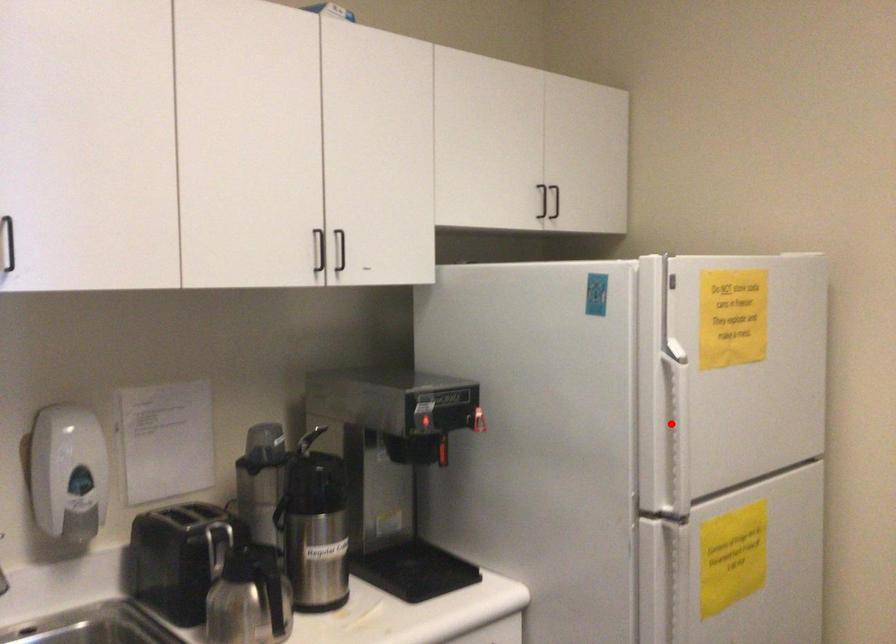
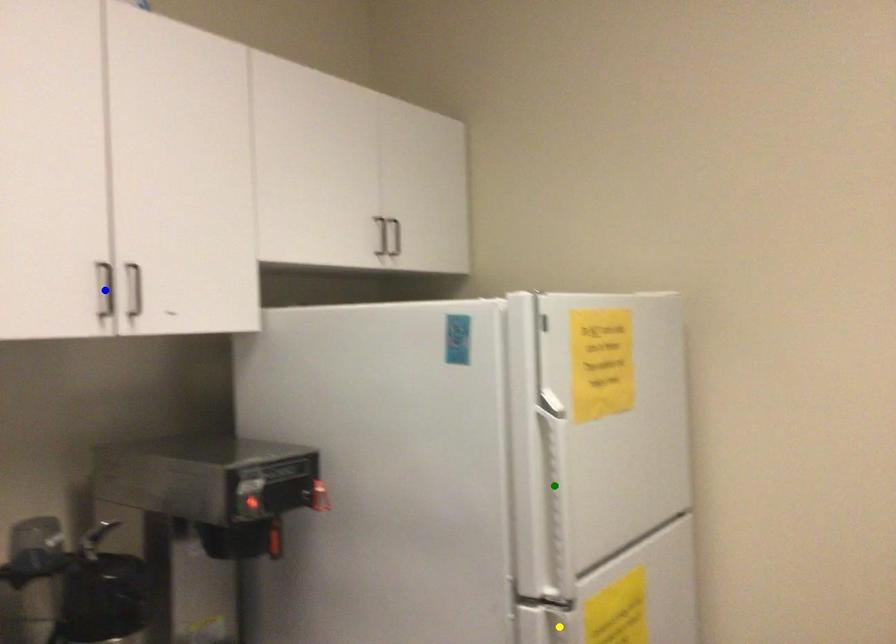
Question: I am providing you with two images of the same scene from different viewpoints. A red point is marked on the first image. You are given multiple points on the second image. Which point in image 2 represents the same 3d spot as the red point in image 1?

Choices:
 (A) green point
 (B) blue point
 (C) yellow point

Answer: (A)